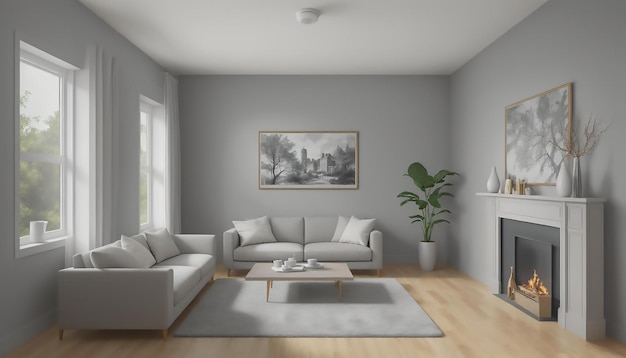
Find the location of a particular element. This screenshot has height=358, width=626. frame is located at coordinates (359, 181).